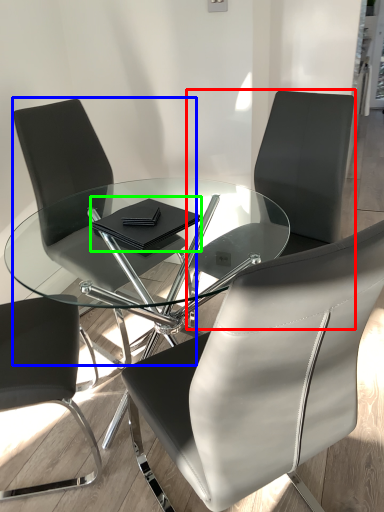
Question: Which object is positioned closest to chair (highlighted by a red box)? Select from chair (highlighted by a blue box) and notebook (highlighted by a green box).

Choices:
 (A) chair
 (B) notebook

Answer: (B)